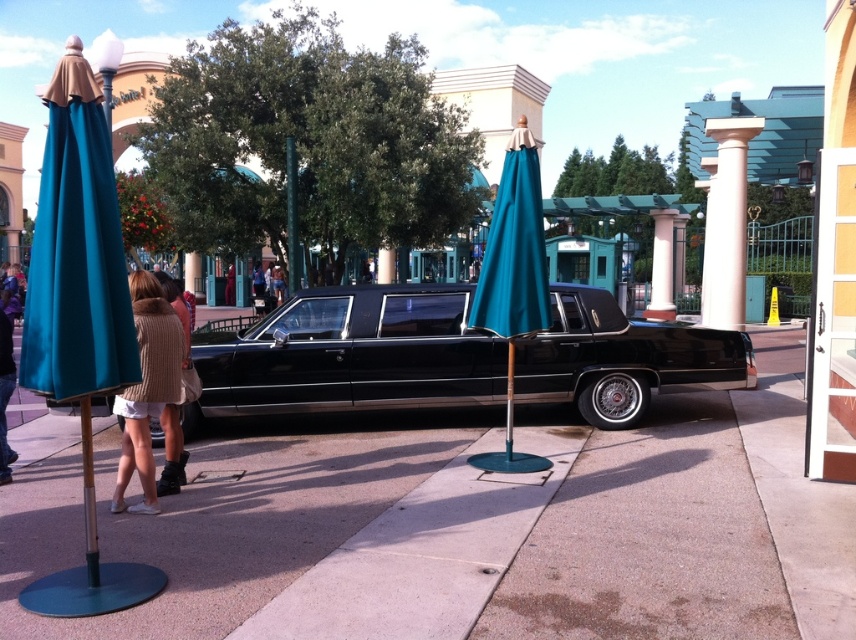
Question: Which point is closer to the camera?

Choices:
 (A) click(738, 160)
 (B) click(455, 300)
 (C) click(652, 234)
 (D) click(513, 205)

Answer: (D)

Question: Is pink polished stone column at center bigger than pink painted stone column at center?

Choices:
 (A) no
 (B) yes

Answer: (B)

Question: Which point appears closest to the camera in this image?

Choices:
 (A) (459, 323)
 (B) (664, 317)

Answer: (A)

Question: Which point is closer to the camera?

Choices:
 (A) (146, 460)
 (B) (673, 369)

Answer: (A)

Question: Is teal fabric umbrella at center further to camera compared to pink painted stone column at center?

Choices:
 (A) yes
 (B) no

Answer: (B)

Question: Does knitted beige sweater at lower left appear on the right side of pink polished stone column at center?

Choices:
 (A) yes
 (B) no

Answer: (B)